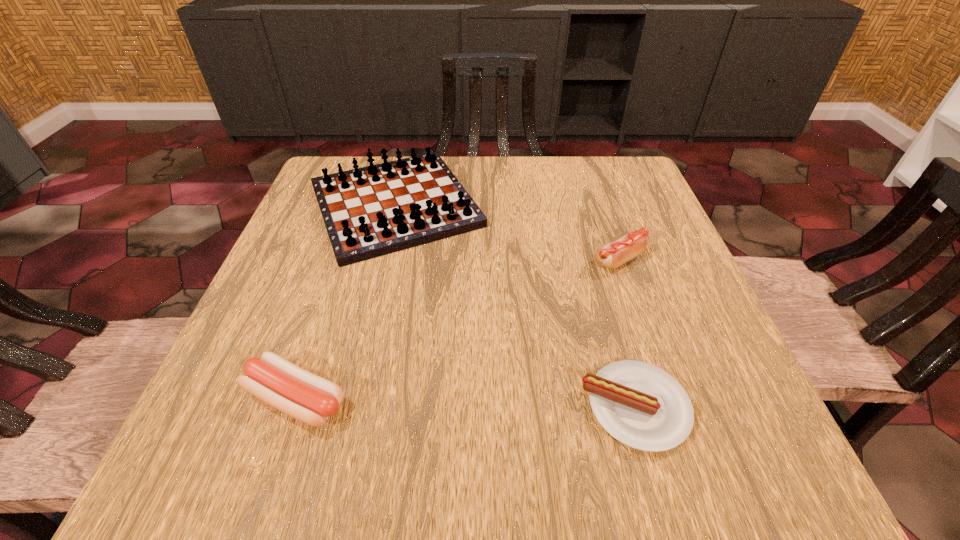
Identify which object is located as the third nearest to the leftmost sausage. Please provide its 2D coordinates. Your answer should be formatted as a tuple, i.e. [(x, y)], where the tuple contains the x and y coordinates of a point satisfying the conditions above.

[(612, 255)]

Identify which sausage is the nearest to the shortest object. Please provide its 2D coordinates. Your answer should be formatted as a tuple, i.e. [(x, y)], where the tuple contains the x and y coordinates of a point satisfying the conditions above.

[(612, 255)]

You are a GUI agent. You are given a task and a screenshot of the screen. Output one action in this format:
    pyautogui.click(x=<x>, y=<y>)
    Task: Click on the sausage that is the second closest to the shortest object
    
    Given the screenshot: What is the action you would take?
    pyautogui.click(x=309, y=398)

The height and width of the screenshot is (540, 960). I want to click on blank area in the image that satisfies the following two spatial constraints: 1. on the front side of the tallest object; 2. on the right side of the farthest sausage, so click(382, 260).

Find the location of a particular element. Image resolution: width=960 pixels, height=540 pixels. vacant space that satisfies the following two spatial constraints: 1. on the front side of the tallest object; 2. on the left side of the farthest sausage is located at coordinates (382, 260).